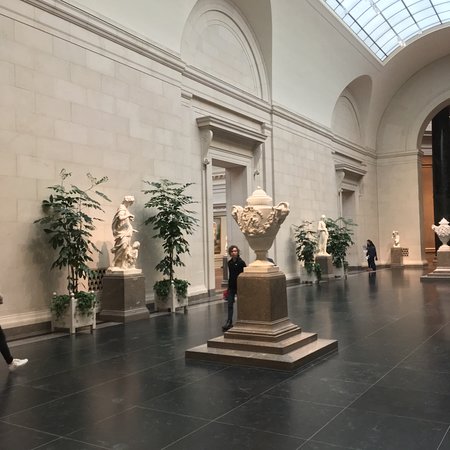
At what (x,y) coordinates should I click in order to perform the action: click on sky light. Please return your answer as a coordinate pair (x, y). The height and width of the screenshot is (450, 450). Looking at the image, I should click on (392, 11).